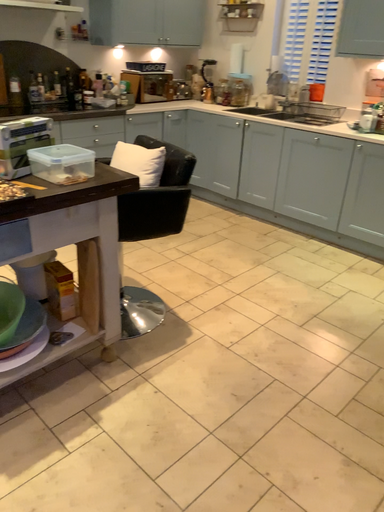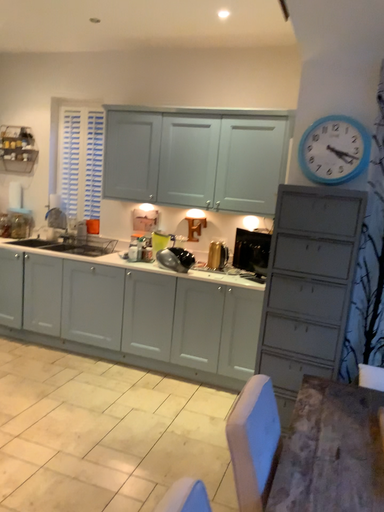
Question: Which way did the camera rotate in the video?

Choices:
 (A) rotated left
 (B) rotated right

Answer: (B)